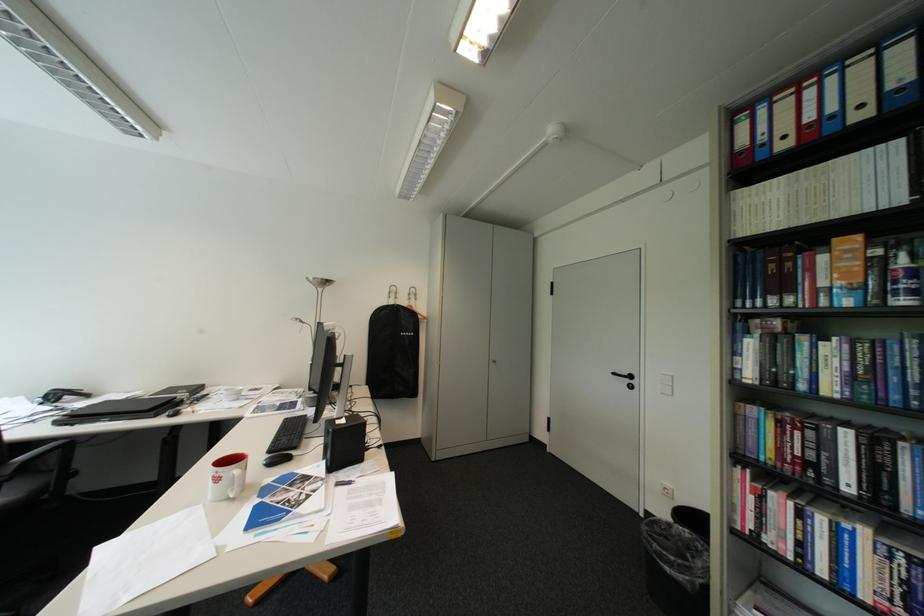
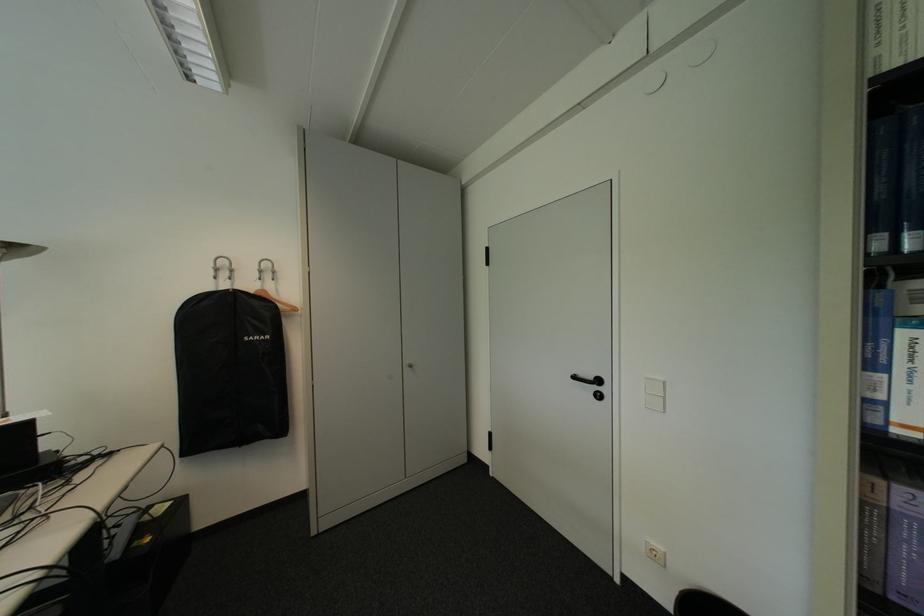
Question: How did the camera likely rotate?

Choices:
 (A) Left
 (B) Right
 (C) Up
 (D) Down

Answer: (B)